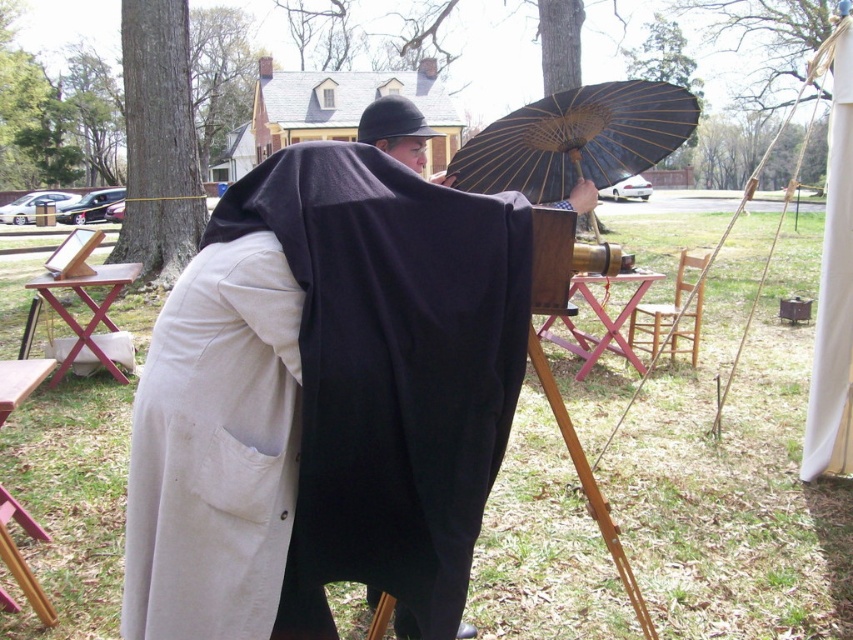
Is the position of pink wood picnic table at center less distant than that of brown wood picnic table at left?

Yes.

Is pink wood picnic table at center wider than brown wood picnic table at left?

Yes, pink wood picnic table at center is wider than brown wood picnic table at left.

Describe the element at coordinates (601, 320) in the screenshot. I see `pink wood picnic table at center` at that location.

I want to click on pink wood picnic table at center, so click(x=601, y=320).

Is point (595, 122) positioned before point (645, 289)?

That is True.

Between point (535, 198) and point (584, 301), which one is positioned in front?

Positioned in front is point (535, 198).

The width and height of the screenshot is (853, 640). In order to click on black paper umbrella at upper center in this screenshot , I will do `click(576, 140)`.

Is white cotton robe at center taller than wooden picnic table at lower left?

Indeed, white cotton robe at center has a greater height compared to wooden picnic table at lower left.

In the scene shown: Does white cotton robe at center have a larger size compared to wooden picnic table at lower left?

Correct, white cotton robe at center is larger in size than wooden picnic table at lower left.

Image resolution: width=853 pixels, height=640 pixels. What are the coordinates of `white cotton robe at center` in the screenshot? It's located at (328, 394).